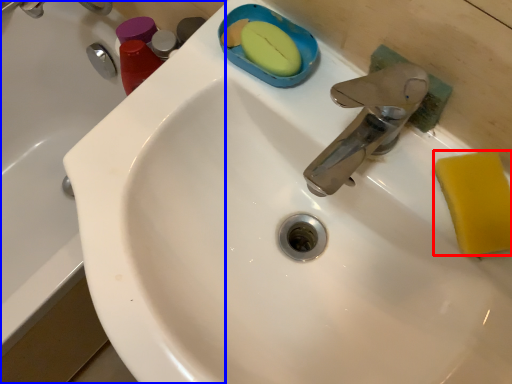
Question: Which object is closer to the camera taking this photo, soap (highlighted by a red box) or bath (highlighted by a blue box)?

Choices:
 (A) soap
 (B) bath

Answer: (A)